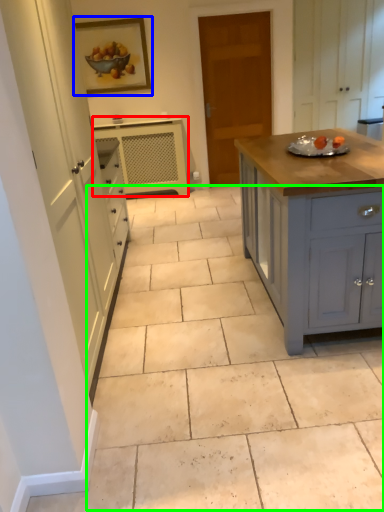
Question: Which object is the closest to the cabinetry (highlighted by a red box)? Choose among these: picture frame (highlighted by a blue box) or path (highlighted by a green box).

Choices:
 (A) picture frame
 (B) path

Answer: (A)